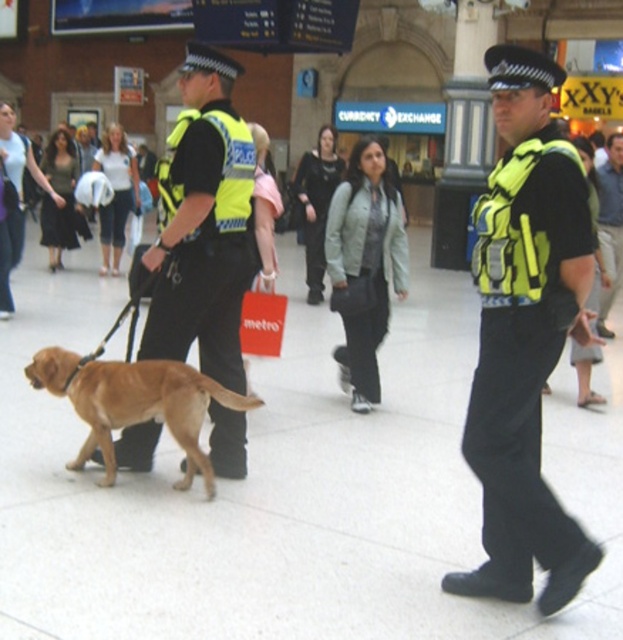
You are a photographer standing in the train station and want to take a photo of the golden fur dog at center and the dark green fabric shirt at center. Which object is closer to the ground?

The golden fur dog at center is shorter than the dark green fabric shirt at center, so the golden fur dog at center is closer to the ground.